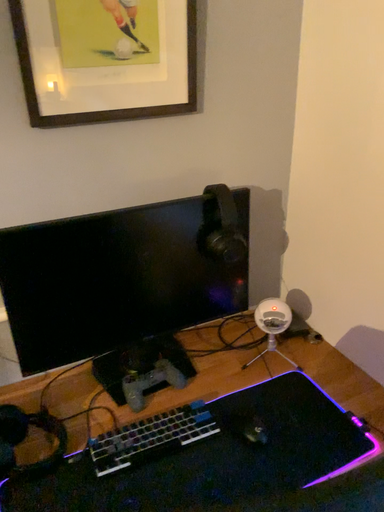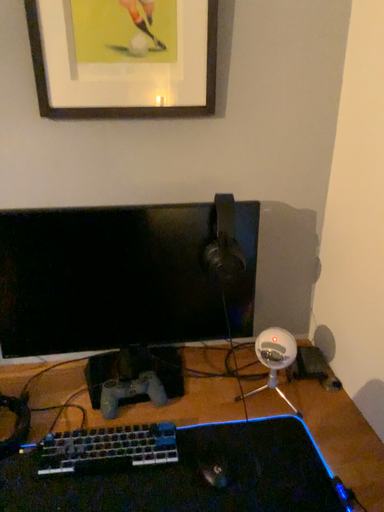
Question: Which way did the camera rotate in the video?

Choices:
 (A) rotated right
 (B) rotated left

Answer: (B)